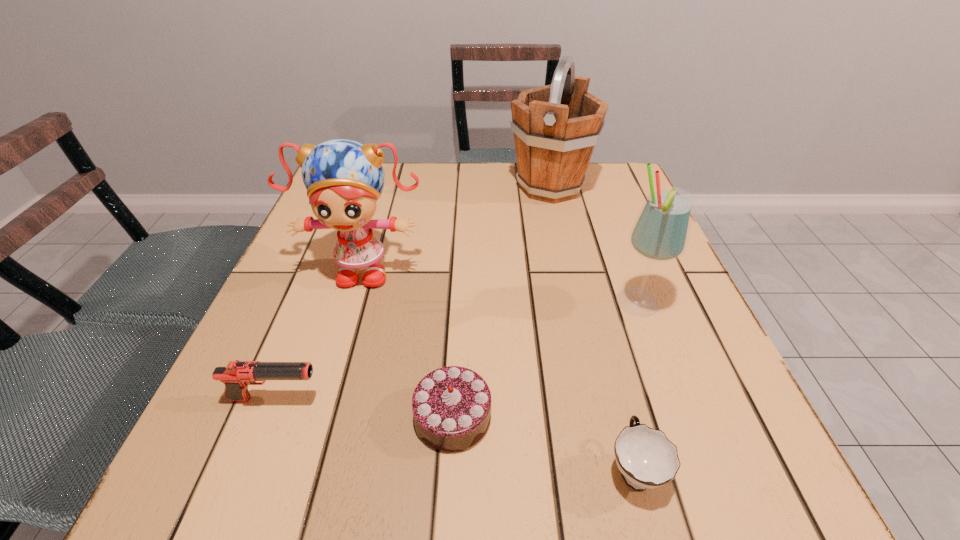
The width and height of the screenshot is (960, 540). Find the location of `bucket`. bucket is located at coordinates (556, 127).

I want to click on alcohol, so click(660, 233).

Locate an element on the screen. doll is located at coordinates (344, 179).

Where is `the third shortest object`? This screenshot has height=540, width=960. the third shortest object is located at coordinates (237, 375).

I want to click on the fourth object from right to left, so click(451, 406).

At what (x,y) coordinates should I click in order to perform the action: click on cup. Please return your answer as a coordinate pair (x, y). Looking at the image, I should click on (646, 458).

You are a GUI agent. You are given a task and a screenshot of the screen. Output one action in this format:
    pyautogui.click(x=<x>, y=<y>)
    Task: Click on the vacant space located on the front of the farthest object
    The height and width of the screenshot is (540, 960).
    Given the screenshot: What is the action you would take?
    pyautogui.click(x=571, y=279)

At what (x,y) coordinates should I click in order to perform the action: click on vacant point located on the left of the alcohol. Please return your answer as a coordinate pair (x, y). This screenshot has height=540, width=960. Looking at the image, I should click on (442, 304).

At what (x,y) coordinates should I click in order to perform the action: click on vacant region located on the face of the doll. Please return your answer as a coordinate pair (x, y). Looking at the image, I should click on (336, 357).

At what (x,y) coordinates should I click in order to perform the action: click on free space located at the aiming end of the third shortest object. Please return your answer as a coordinate pair (x, y). This screenshot has width=960, height=540. Looking at the image, I should click on (535, 399).